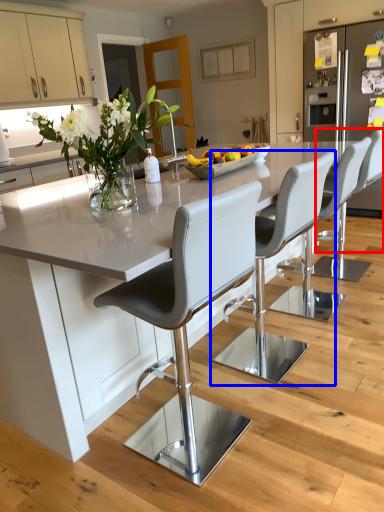
Question: Which point is further to the camera, chair (highlighted by a red box) or chair (highlighted by a blue box)?

Choices:
 (A) chair
 (B) chair

Answer: (A)